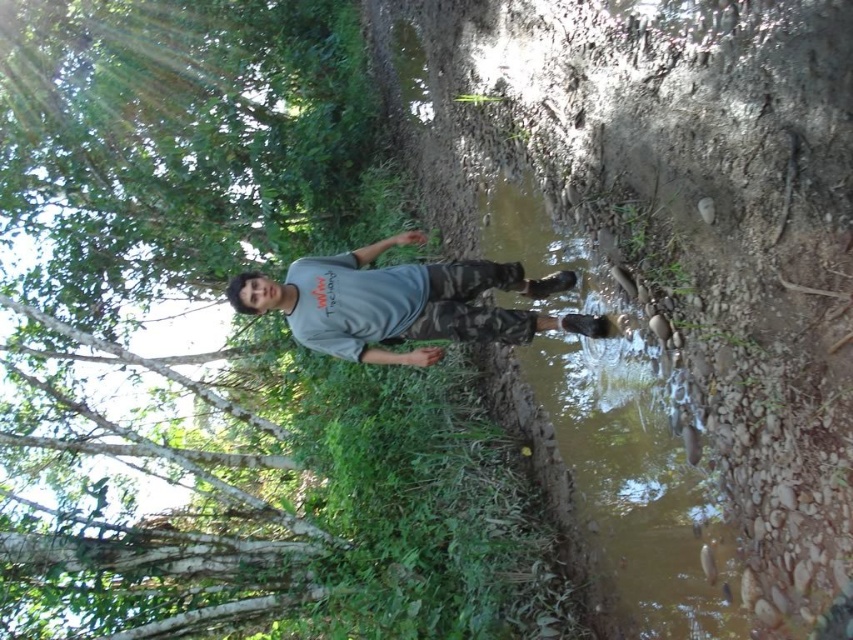
Question: Which of the following is the farthest from the observer?

Choices:
 (A) brown muddy stream at center
 (B) gray matte shirt at center
 (C) green leafy tree at upper left

Answer: (C)

Question: Which point is farther from the camera taking this photo?

Choices:
 (A) (225, 548)
 (B) (508, 285)

Answer: (A)

Question: Does green leafy tree at upper left have a larger size compared to gray matte shirt at center?

Choices:
 (A) no
 (B) yes

Answer: (A)

Question: Considering the real-world distances, which object is farthest from the gray matte shirt at center?

Choices:
 (A) green leafy tree at upper left
 (B) brown muddy stream at center

Answer: (A)

Question: Can you confirm if brown muddy stream at center is positioned to the right of gray matte shirt at center?

Choices:
 (A) yes
 (B) no

Answer: (A)

Question: Is brown muddy stream at center bigger than green leafy tree at upper left?

Choices:
 (A) yes
 (B) no

Answer: (A)